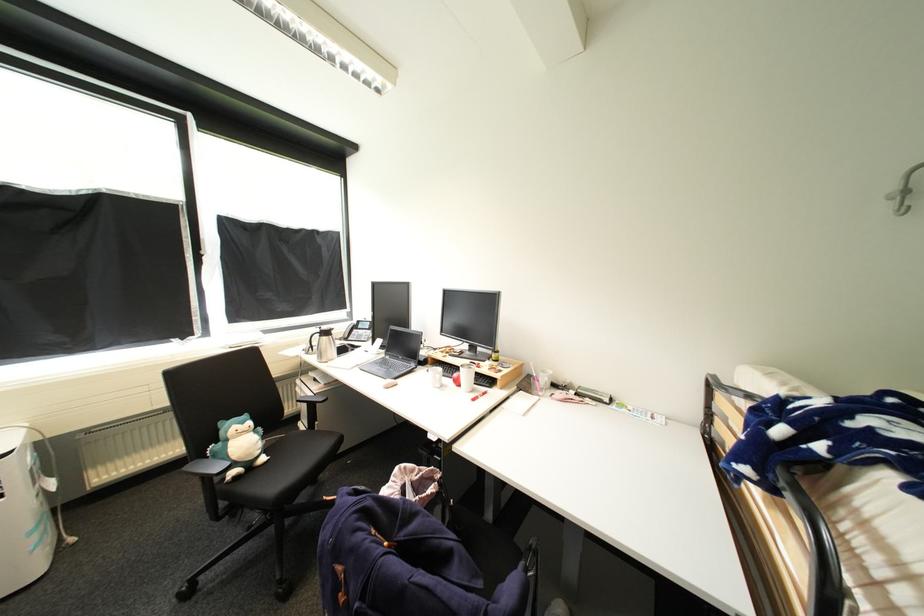
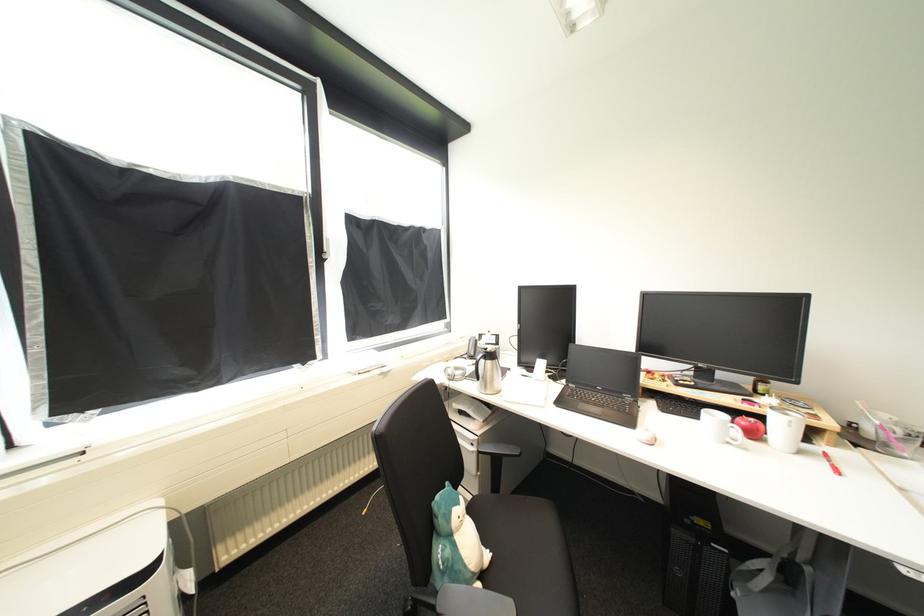
Where in the second image is the point corresponding to point 332,339 from the first image?

(495, 363)